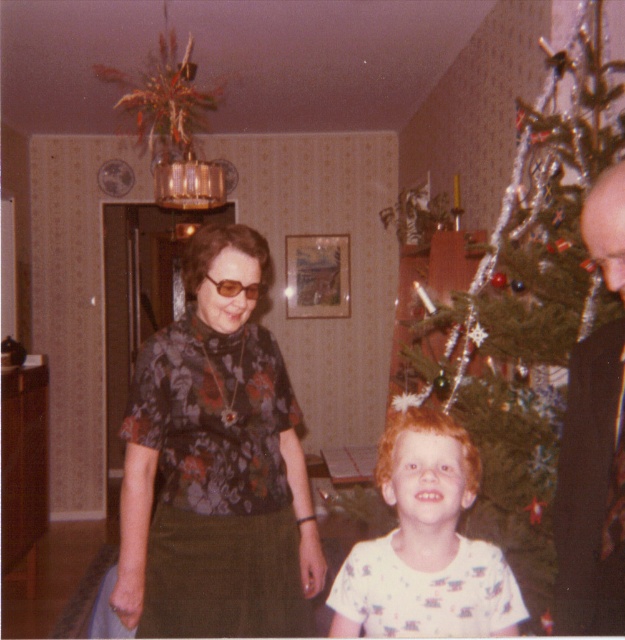
Can you confirm if floral print blouse at center is positioned above dark brown leather jacket at right?

No, floral print blouse at center is not above dark brown leather jacket at right.

Looking at this image, does floral print blouse at center come in front of dark brown leather jacket at right?

That is False.

Does point (242, 516) come behind point (618, 509)?

Yes.

Where is `floral print blouse at center`? This screenshot has height=640, width=625. floral print blouse at center is located at coordinates (216, 465).

Is green textured christmas tree at right in front of white cotton shirt at center?

No, it is behind white cotton shirt at center.

Image resolution: width=625 pixels, height=640 pixels. Describe the element at coordinates (556, 364) in the screenshot. I see `green textured christmas tree at right` at that location.

What are the coordinates of `green textured christmas tree at right` in the screenshot? It's located at (556, 364).

Does green textured christmas tree at right have a larger size compared to dark brown leather jacket at right?

Correct, green textured christmas tree at right is larger in size than dark brown leather jacket at right.

Can you confirm if green textured christmas tree at right is positioned to the left of dark brown leather jacket at right?

In fact, green textured christmas tree at right is to the right of dark brown leather jacket at right.

Describe the element at coordinates (556, 364) in the screenshot. This screenshot has width=625, height=640. I see `green textured christmas tree at right` at that location.

At what (x,y) coordinates should I click in order to perform the action: click on green textured christmas tree at right. Please return your answer as a coordinate pair (x, y). This screenshot has width=625, height=640. Looking at the image, I should click on (556, 364).